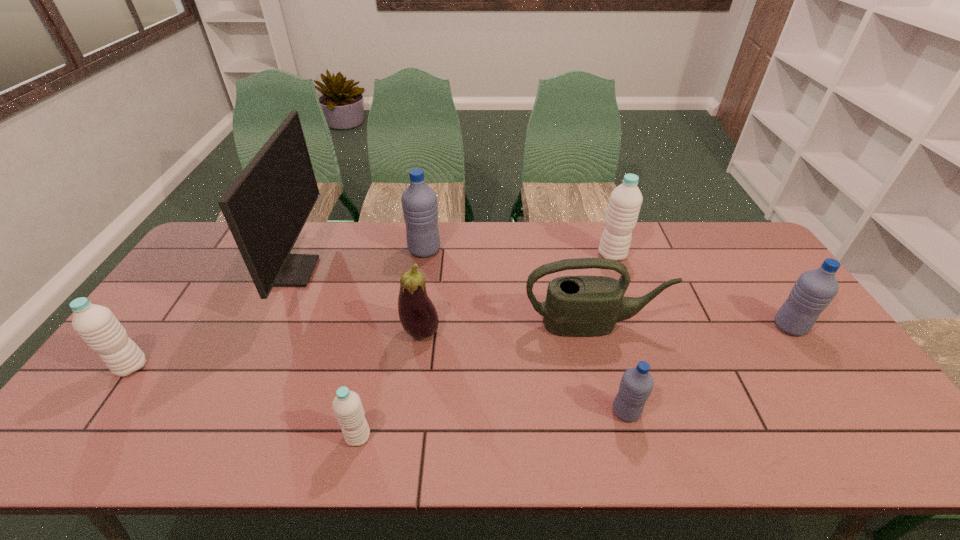
Locate an element on the screen. This screenshot has height=540, width=960. vacant area situated on the spout of the green watering can is located at coordinates (617, 420).

At what (x,y) coordinates should I click in order to perform the action: click on free point located on the front of the rightmost object. Please return your answer as a coordinate pair (x, y). Image resolution: width=960 pixels, height=540 pixels. Looking at the image, I should click on (880, 457).

Identify the location of free space located 0.290m on the back of the leftmost object. (192, 282).

Identify the location of free location located on the right of the eighth farthest object. Image resolution: width=960 pixels, height=540 pixels. (711, 411).

The image size is (960, 540). What are the coordinates of `vacant space located on the right of the smallest white water bottle` in the screenshot? It's located at (432, 437).

Locate an element on the screen. computer monitor present at the far edge is located at coordinates (266, 207).

Identify the location of object situated at the left edge. This screenshot has height=540, width=960. (96, 325).

You are a GUI agent. You are given a task and a screenshot of the screen. Output one action in this format:
    pyautogui.click(x=<x>, y=<y>)
    Task: Click on the object present at the right edge
    This screenshot has width=960, height=540.
    Given the screenshot: What is the action you would take?
    pyautogui.click(x=814, y=290)

The height and width of the screenshot is (540, 960). I want to click on vacant space at the far edge of the desktop, so click(634, 232).

Find the location of a particular element. vacant space at the near edge of the desktop is located at coordinates (317, 452).